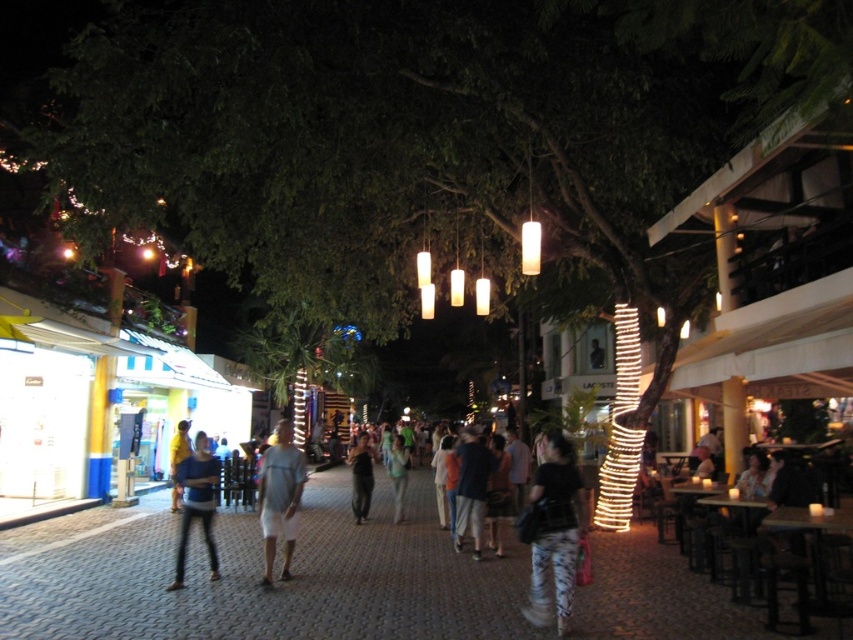
You are a photographer standing on the street and want to capture both the matte blue shirt at center and the light blue denim jeans at center in a single frame. Since the shirt is thinner, will it be easier to fit both into the camera frame?

The matte blue shirt at center is thinner than the light blue denim jeans at center, so it will be easier to fit both into the camera frame since the shirt takes up less space.

You are walking along the street and see a green leafy tree at center and a black matte bag at lower right. Which object is positioned to the left when viewed from your perspective?

The green leafy tree at center is positioned to the left of the black matte bag at lower right.

You are standing at point (305,355) in the image. What object is exactly at your current location?

The green leafy tree at center is located at point (305,355).